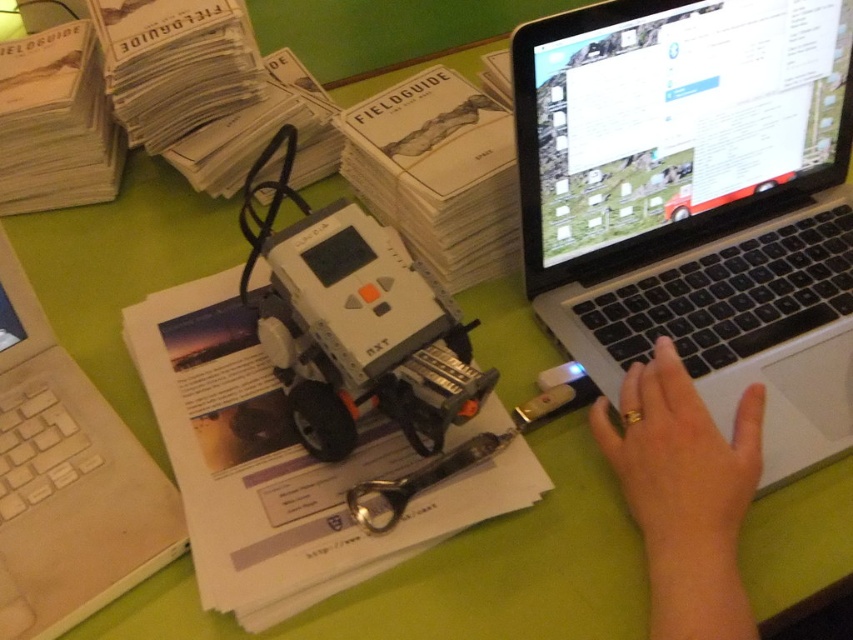
Question: Does white matte printer at center appear on the left side of gold ring at lower right?

Choices:
 (A) yes
 (B) no

Answer: (A)

Question: Is white matte printer at center bigger than beige plastic laptop at lower left?

Choices:
 (A) no
 (B) yes

Answer: (B)

Question: Which is nearer to the beige plastic laptop at lower left?

Choices:
 (A) gold ring at lower right
 (B) white matte printer at center

Answer: (B)

Question: Which point is farther from the camera taking this photo?

Choices:
 (A) (708, 403)
 (B) (173, 493)
 (C) (688, 609)

Answer: (A)

Question: Which point is farther to the camera?

Choices:
 (A) (131, 509)
 (B) (672, 448)

Answer: (A)

Question: Is silver/black laptop at right thinner than beige plastic laptop at lower left?

Choices:
 (A) yes
 (B) no

Answer: (B)